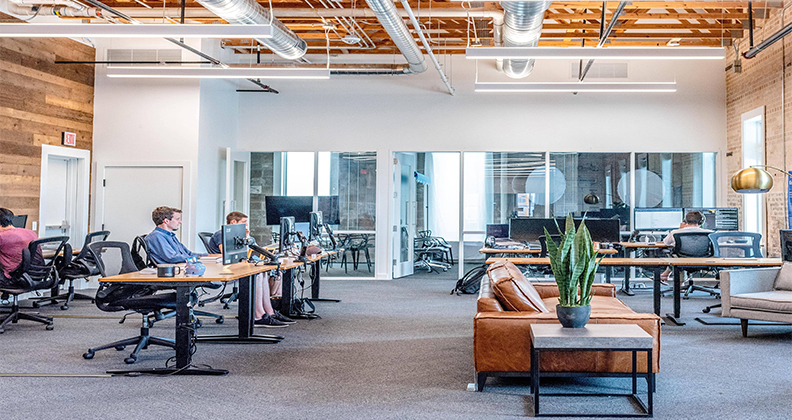
Find the location of a particular element. The width and height of the screenshot is (792, 420). mug is located at coordinates (164, 268).